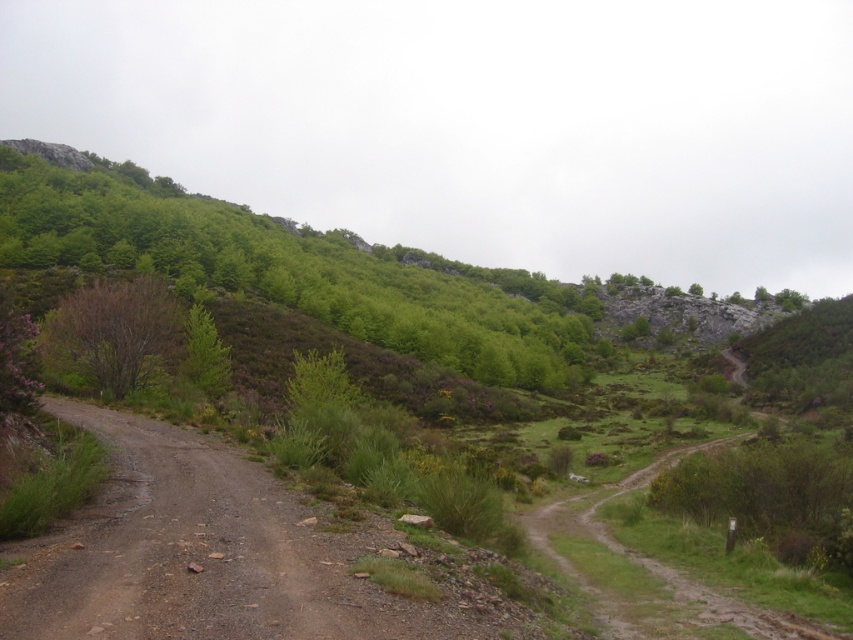
Between green leafy tree at upper left and green leafy tree at center-left, which one has more height?

With more height is green leafy tree at upper left.

Which of these two, green leafy tree at upper left or green leafy tree at center-left, stands shorter?

green leafy tree at center-left

Identify the location of green leafy tree at upper left. (292, 269).

Is point (112, 240) positioned after point (62, 330)?

That is True.

Is green leafy tree at upper left smaller than brown leafless tree at left?

Actually, green leafy tree at upper left might be larger than brown leafless tree at left.

Between point (521, 296) and point (48, 342), which one is positioned in front?

Point (48, 342)

The width and height of the screenshot is (853, 640). Find the location of `green leafy tree at upper left`. green leafy tree at upper left is located at coordinates (x=292, y=269).

Is brown leafless tree at left above green leafy tree at center-left?

Correct, brown leafless tree at left is located above green leafy tree at center-left.

The image size is (853, 640). I want to click on brown leafless tree at left, so click(x=109, y=336).

Where is `brown leafless tree at left`? brown leafless tree at left is located at coordinates (109, 336).